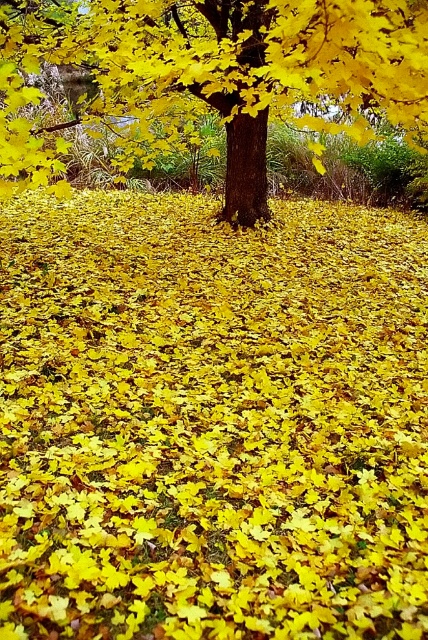
Who is positioned more to the left, yellow matte leaves at center or shiny brown tree trunk at center?

Positioned to the left is shiny brown tree trunk at center.

Which is in front, point (119, 358) or point (240, 168)?

Point (119, 358)

I want to click on yellow matte leaves at center, so click(211, 420).